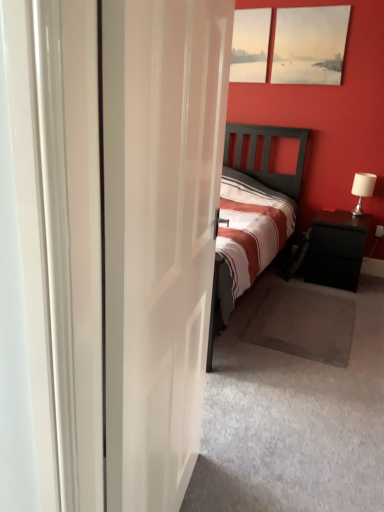
Where is `free location in front of black matte nightstand at right`? free location in front of black matte nightstand at right is located at coordinates (339, 298).